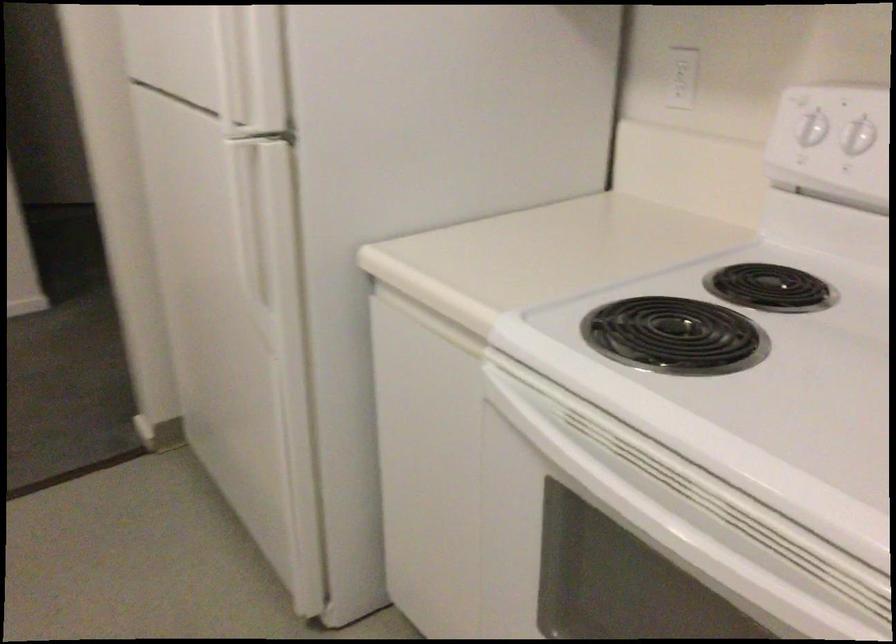
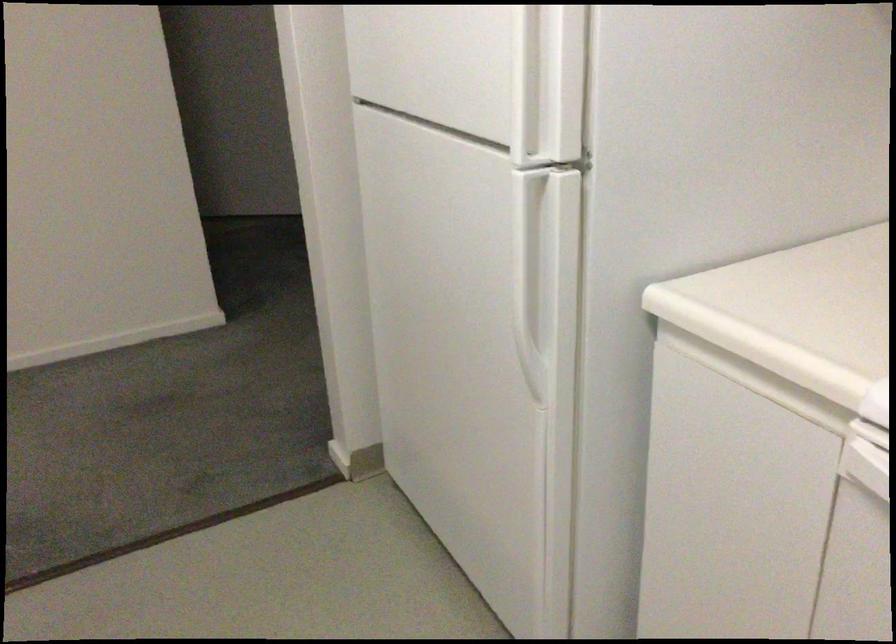
Question: The camera is either moving clockwise (left) or counter-clockwise (right) around the object. The first image is from the beginning of the video and the second image is from the end. Is the camera moving left or right when shooting the video?

Choices:
 (A) Left
 (B) Right

Answer: (B)